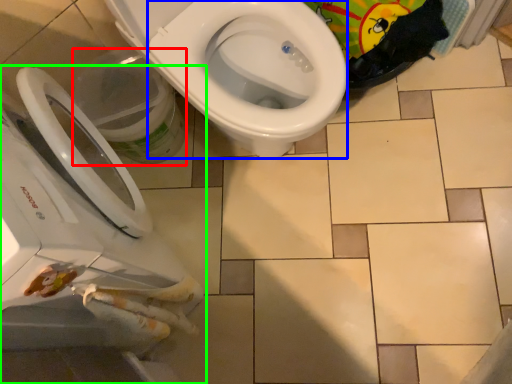
Question: Which object is positioned farthest from potty (highlighted by a red box)? Select from bidet (highlighted by a blue box) and toilet (highlighted by a green box).

Choices:
 (A) bidet
 (B) toilet

Answer: (B)